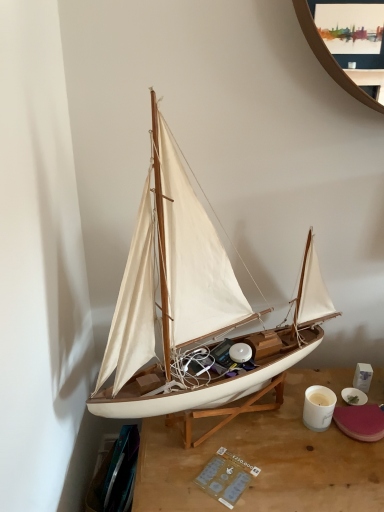
The width and height of the screenshot is (384, 512). I want to click on free space in front of white glossy coffee cup at lower right, so click(321, 467).